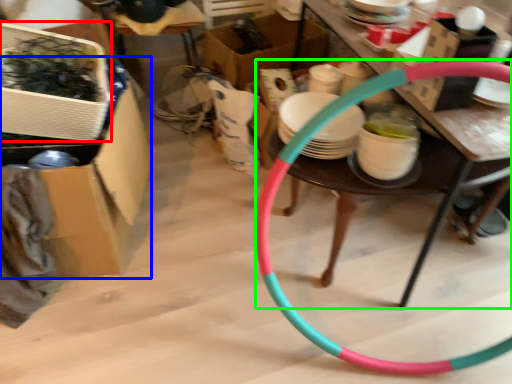
Question: Based on their relative distances, which object is nearer to box (highlighted by a red box)? Choose from box (highlighted by a blue box) and table (highlighted by a green box).

Choices:
 (A) box
 (B) table

Answer: (A)